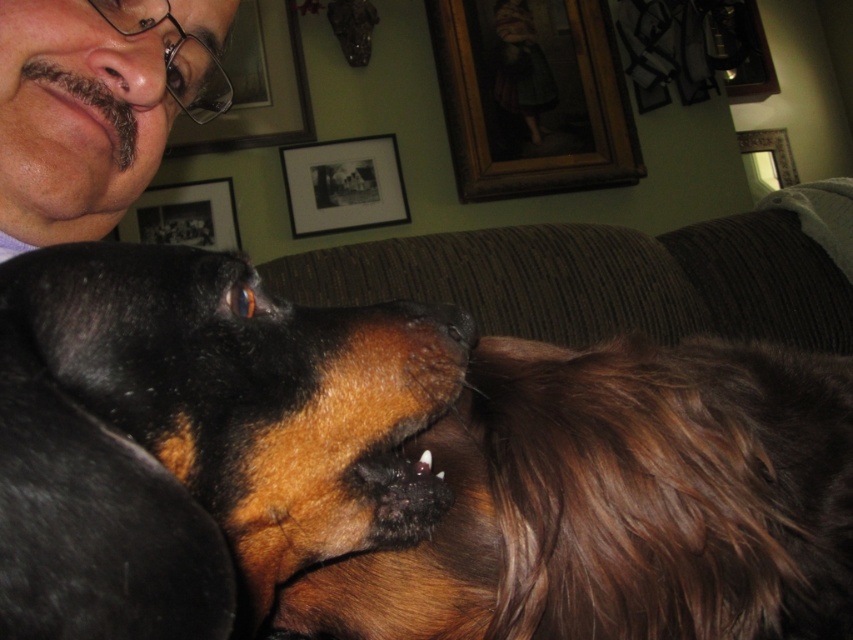
At what (x,y) coordinates should I click in order to perform the action: click on matte glass picture frame at upper left. Please return your answer as a coordinate pair (x, y). Looking at the image, I should click on (256, 86).

Which is above, matte glass picture frame at upper left or wooden frame at upper right?

Positioned higher is matte glass picture frame at upper left.

Identify the location of matte glass picture frame at upper left. (256, 86).

How far apart are brown fuzzy dog at center and black matte picture frame at upper center?

brown fuzzy dog at center and black matte picture frame at upper center are 8.46 feet apart from each other.

Is brown fuzzy dog at center shorter than black matte picture frame at upper center?

Yes.

Is point (729, 628) farther from viewer compared to point (309, 160)?

That is False.

This screenshot has height=640, width=853. Find the location of `brown fuzzy dog at center`. brown fuzzy dog at center is located at coordinates (619, 500).

Which is above, matte glass picture frame at upper left or black matte picture frame at upper center?

matte glass picture frame at upper left is higher up.

Which is more to the right, matte glass picture frame at upper left or black matte picture frame at upper center?

black matte picture frame at upper center is more to the right.

Measure the distance between matte glass picture frame at upper left and camera.

A distance of 9.20 feet exists between matte glass picture frame at upper left and camera.

Identify the location of matte glass picture frame at upper left. (256, 86).